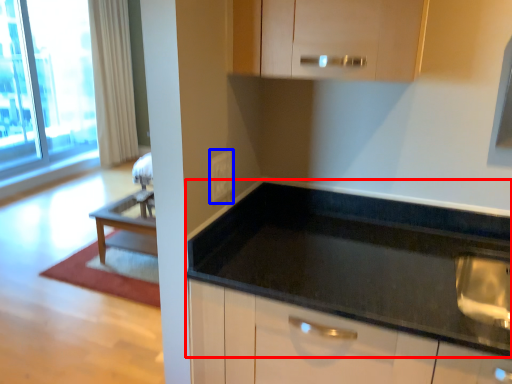
Question: Which object appears farthest to the camera in this image, countertop (highlighted by a red box) or electric outlet (highlighted by a blue box)?

Choices:
 (A) countertop
 (B) electric outlet

Answer: (B)